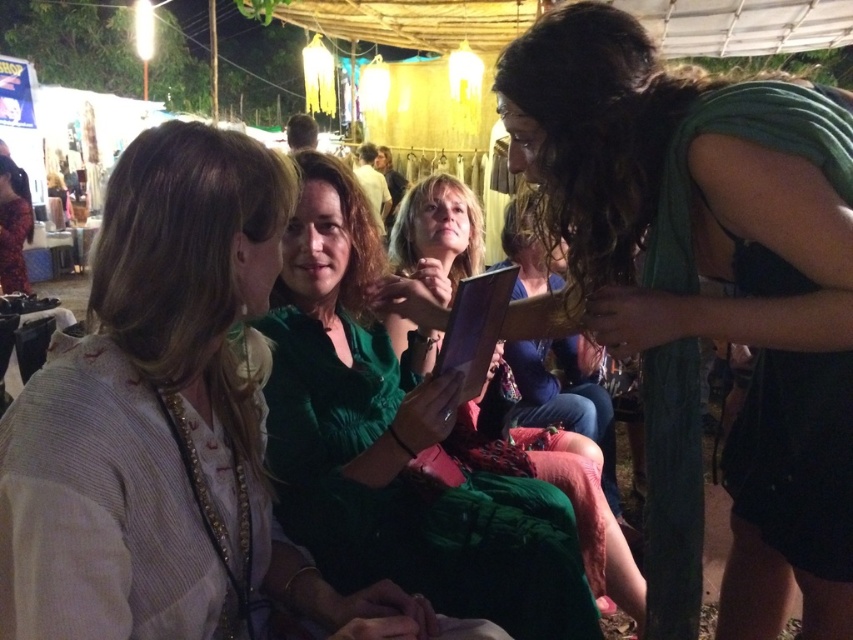
Question: Does green fabric scarf at center lie in front of matte green dress at center?

Choices:
 (A) yes
 (B) no

Answer: (B)

Question: Among these objects, which one is farthest from the camera?

Choices:
 (A) green fabric scarf at center
 (B) green satin dress at center

Answer: (B)

Question: Estimate the real-world distances between objects in this image. Which object is farther from the matte green dress at center?

Choices:
 (A) green satin dress at center
 (B) green fabric scarf at center

Answer: (B)

Question: Which point is farther from the camera taking this photo?

Choices:
 (A) (431, 477)
 (B) (805, 403)
 (C) (22, 406)

Answer: (A)

Question: In this image, where is green fabric scarf at center located relative to green satin dress at center?

Choices:
 (A) above
 (B) below

Answer: (A)

Question: Does matte green dress at center appear over green satin dress at center?

Choices:
 (A) no
 (B) yes

Answer: (B)